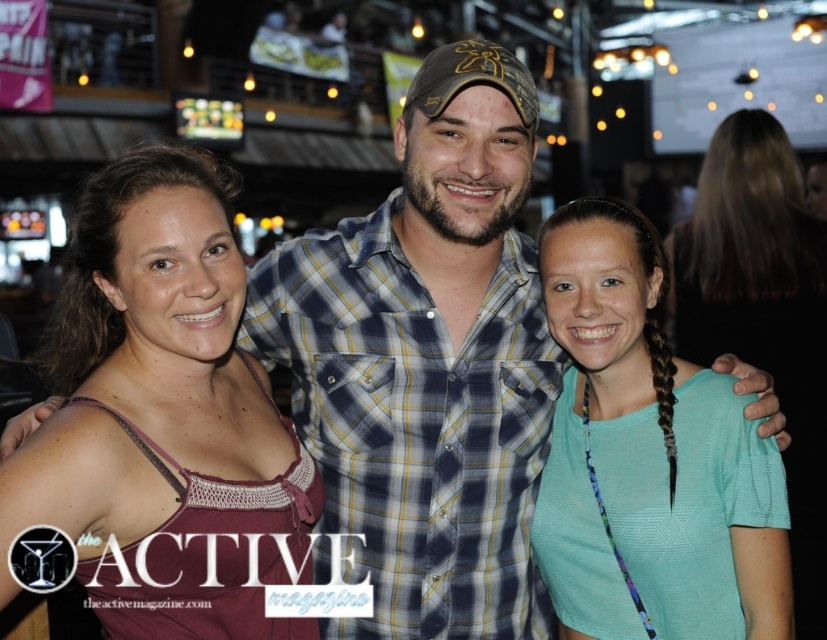
You are a photographer trying to adjust the lighting for a group photo. You notice two shirts in the frame, the matte purple tank top at left and the teal fabric shirt at right. Which shirt should you focus on to ensure proper exposure since it takes up more space in the frame?

The matte purple tank top at left should be focused on for proper exposure because it is larger in size than the teal fabric shirt at right, meaning it occupies more space in the frame.

You are taking a photo of the scene described. The camera is positioned at a certain distance from the point marked at coordinates (77, 292). If the camera has a focal length of 50mm and you want to ensure the subject at that point is in focus, what is the minimum distance you should maintain between the camera and the point to achieve sharp focus?

The minimum distance required to ensure the subject at point (77, 292) is in focus is 9.29 feet, as stated in the description.